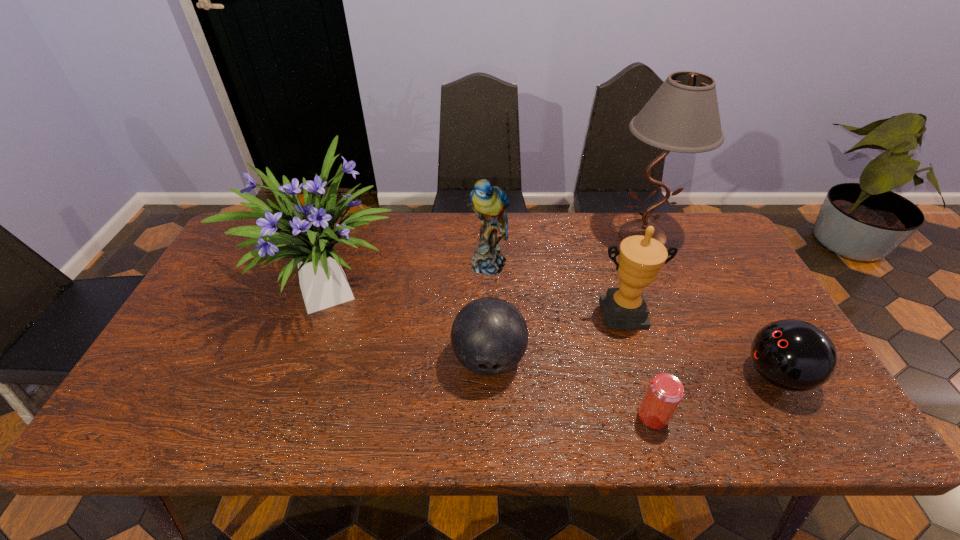
Identify the location of the fifth closest object to the left bowling ball. (682, 116).

You are a GUI agent. You are given a task and a screenshot of the screen. Output one action in this format:
    pyautogui.click(x=<x>, y=<y>)
    Task: Click on the object that can be found as the second closest to the left bowling ball
    The height and width of the screenshot is (540, 960).
    Given the screenshot: What is the action you would take?
    pyautogui.click(x=489, y=202)

At what (x,y) coordinates should I click in order to perform the action: click on vacant point that satisfies the following two spatial constraints: 1. on the face of the parrot; 2. on the right side of the beer can. Please return your answer as a coordinate pair (x, y). Looking at the image, I should click on (492, 416).